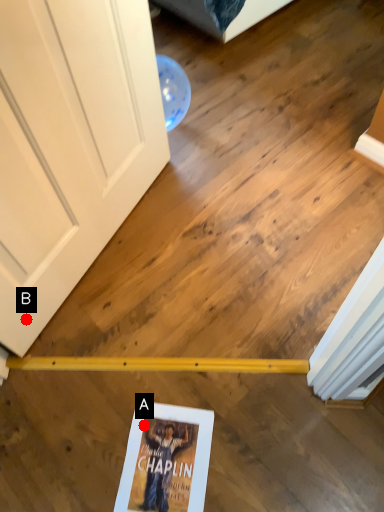
Question: Two points are circled on the image, labeled by A and B beside each circle. Which point is closer to the camera taking this photo?

Choices:
 (A) A is closer
 (B) B is closer

Answer: (A)